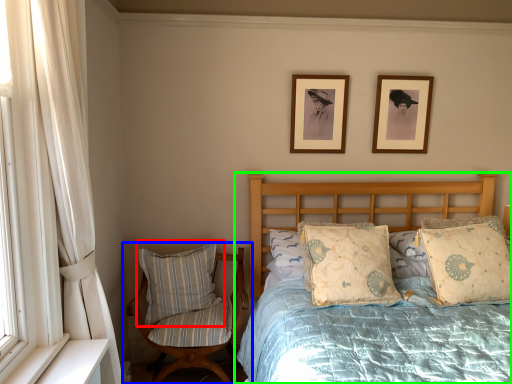
Question: Considering the real-world distances, which object is closest to pillow (highlighted by a red box)? chair (highlighted by a blue box) or bed (highlighted by a green box).

Choices:
 (A) chair
 (B) bed

Answer: (A)